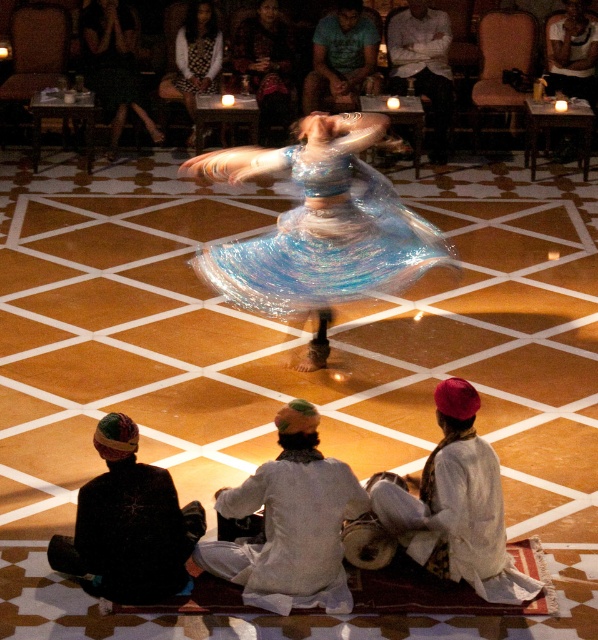
Question: Which object appears closest to the camera in this image?

Choices:
 (A) white shirt at upper center
 (B) white cotton turban at lower right
 (C) patterned fabric dress at center
 (D) patterned fabric dress at upper center

Answer: (B)

Question: Is iridescent fabric dress at center above white cotton turban at lower center?

Choices:
 (A) yes
 (B) no

Answer: (A)

Question: In this image, where is white cotton turban at lower center located relative to white dotted dress at upper center?

Choices:
 (A) below
 (B) above

Answer: (A)

Question: Which point is farther to the camera?

Choices:
 (A) white shirt at upper center
 (B) shiny black dress at upper center
 (C) patterned fabric dress at upper center

Answer: (C)

Question: Does iridescent fabric dress at center have a lesser width compared to dark brown leather jacket at lower left?

Choices:
 (A) no
 (B) yes

Answer: (A)

Question: Which object is farther from the camera taking this photo?

Choices:
 (A) iridescent fabric dress at center
 (B) white cotton turban at lower right
 (C) shiny black dress at upper center

Answer: (C)